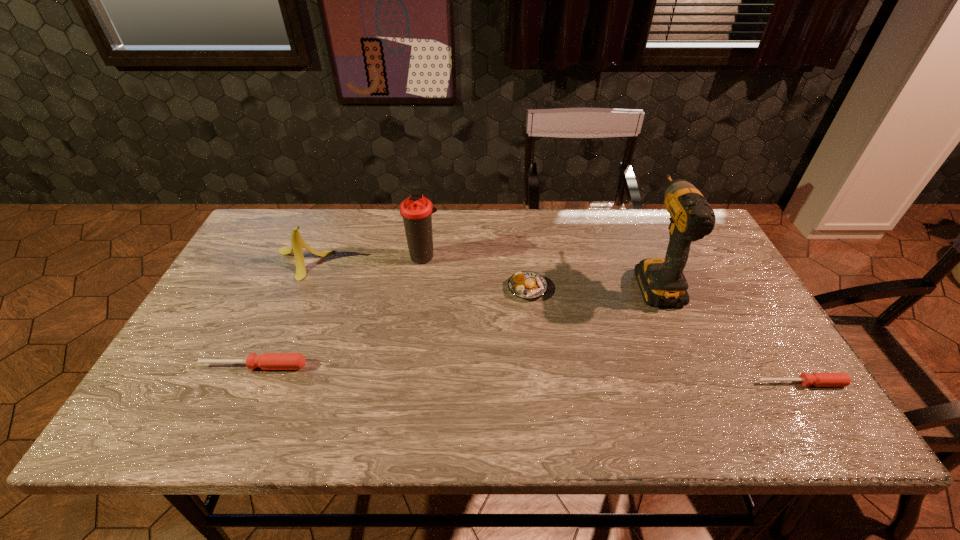
Locate an element on the screen. The width and height of the screenshot is (960, 540). vacant space situated on the right of the taller screwdriver is located at coordinates (443, 366).

The height and width of the screenshot is (540, 960). Find the location of `free space located on the left of the rightmost object`. free space located on the left of the rightmost object is located at coordinates (665, 383).

The width and height of the screenshot is (960, 540). I want to click on vacant space located 0.310m on the left of the third object from left to right, so click(303, 256).

At what (x,y) coordinates should I click in order to perform the action: click on blank space located 0.160m with the drill bit of the drill facing forward. Please return your answer as a coordinate pair (x, y). The image size is (960, 540). Looking at the image, I should click on coord(630,220).

Identify the location of vacant space located with the drill bit of the drill facing forward. Image resolution: width=960 pixels, height=540 pixels. (631, 222).

Where is `free spot located 0.170m with the drill bit of the drill facing forward`? The height and width of the screenshot is (540, 960). free spot located 0.170m with the drill bit of the drill facing forward is located at coordinates (629, 219).

The image size is (960, 540). Identify the location of free space located 0.340m on the left of the fourth object from left to right. (386, 288).

Find the location of a particular element. This screenshot has width=960, height=540. vacant space located on the back of the banana is located at coordinates point(314,236).

You are a GUI agent. You are given a task and a screenshot of the screen. Output one action in this format:
    pyautogui.click(x=<x>, y=<y>)
    Task: Click on the thermos bottle present at the far edge
    The width and height of the screenshot is (960, 540).
    Given the screenshot: What is the action you would take?
    pyautogui.click(x=417, y=211)

Where is `drill at the far edge`? drill at the far edge is located at coordinates (661, 280).